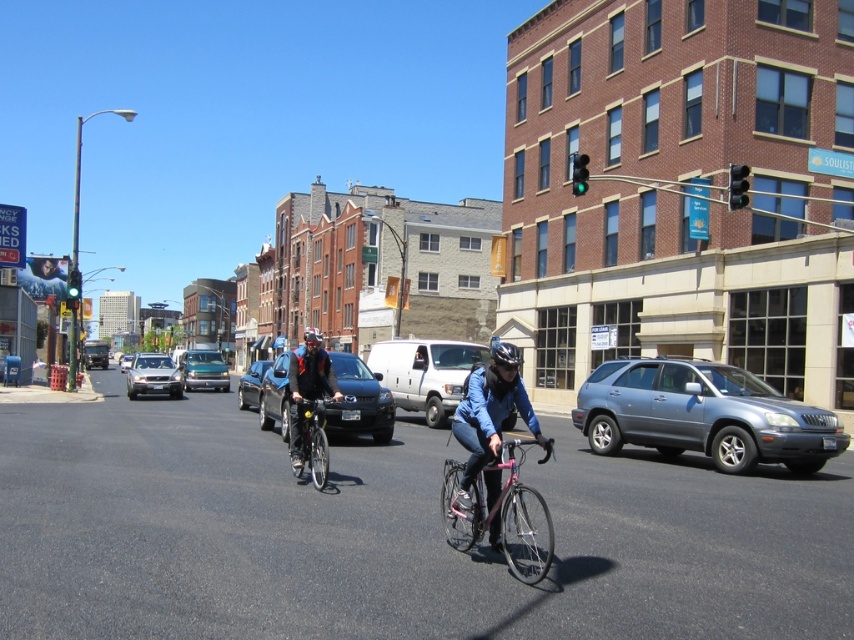
Does shiny pink bicycle at center have a lesser height compared to shiny black sedan at center?

Yes, shiny pink bicycle at center is shorter than shiny black sedan at center.

Between point (449, 477) and point (241, 397), which one is positioned in front?

Positioned in front is point (449, 477).

Where is `shiny pink bicycle at center`? shiny pink bicycle at center is located at coordinates (502, 516).

Can you confirm if shiny pink bicycle at center is thinner than silver metallic suv at center-left?

Yes, shiny pink bicycle at center is thinner than silver metallic suv at center-left.

In the scene shown: Which is more to the left, shiny pink bicycle at center or silver metallic suv at center-left?

silver metallic suv at center-left is more to the left.

Who is more distant from viewer, (544, 458) or (142, 376)?

The point (142, 376) is more distant.

Where is `shiny pink bicycle at center`? Image resolution: width=854 pixels, height=640 pixels. shiny pink bicycle at center is located at coordinates (502, 516).

Which is below, metallic bicycle at center or metallic blue suv at right?

metallic bicycle at center

Identify the location of metallic bicycle at center. (390, 536).